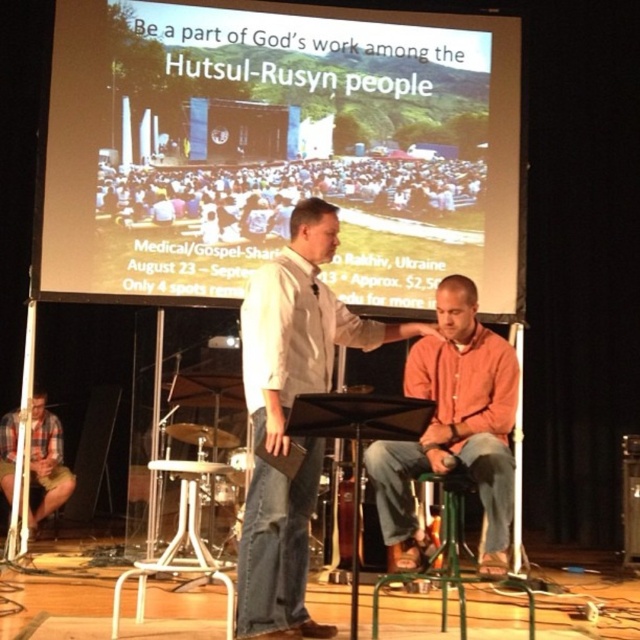
Is the position of plaid cotton shorts at lower left more distant than that of brushed metal drum at lower left?

Yes, it is.

Measure the distance between plaid cotton shorts at lower left and camera.

20.34 feet

Based on the photo, who is more forward, (42, 422) or (196, 424)?

Point (196, 424) is more forward.

The image size is (640, 640). I want to click on plaid cotton shorts at lower left, so click(x=48, y=460).

Does white shirt at center appear on the left side of green metal stool at lower center?

Indeed, white shirt at center is positioned on the left side of green metal stool at lower center.

Looking at this image, which is more to the left, white shirt at center or green metal stool at lower center?

From the viewer's perspective, white shirt at center appears more on the left side.

Between point (288, 323) and point (401, 573), which one is positioned behind?

Point (401, 573)

The image size is (640, 640). Find the location of `white shirt at center`. white shirt at center is located at coordinates (285, 413).

In the scene shown: Is wooden floor at lower center to the right of green metal stool at lower center from the viewer's perspective?

Correct, you'll find wooden floor at lower center to the right of green metal stool at lower center.

Between point (96, 612) and point (444, 618), which one is positioned in front?

Point (444, 618) is in front.

Is point (605, 608) positioned in front of point (428, 570)?

No.

This screenshot has height=640, width=640. In order to click on wooden floor at lower center in this screenshot , I will do `click(588, 589)`.